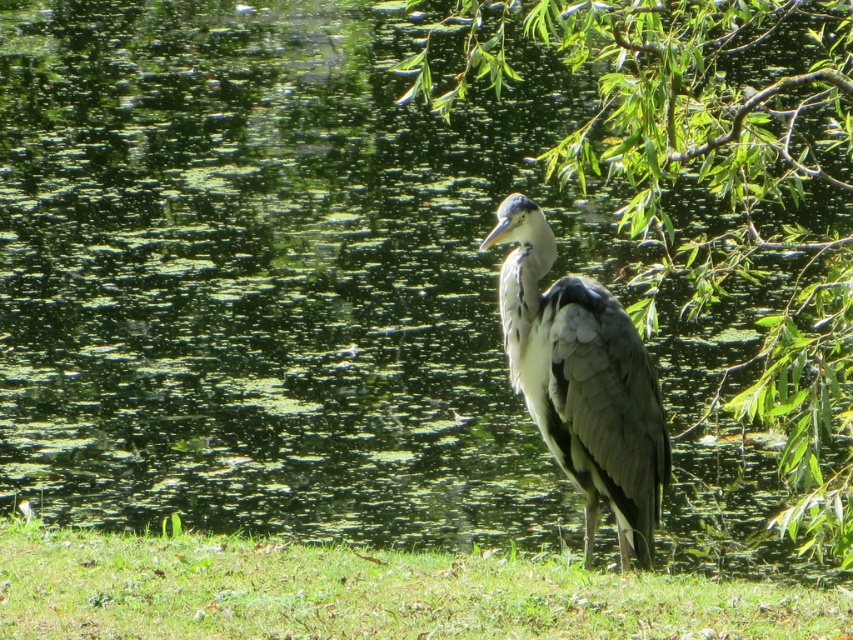
Question: Is green leafy tree at center positioned at the back of green grass at lower center?

Choices:
 (A) yes
 (B) no

Answer: (B)

Question: Among these points, which one is farthest from the camera?

Choices:
 (A) (247, 634)
 (B) (648, 476)
 (C) (647, 131)

Answer: (B)

Question: Is green leafy tree at center above gray feathered heron at center?

Choices:
 (A) no
 (B) yes

Answer: (B)

Question: From the image, what is the correct spatial relationship of green leafy tree at center in relation to gray feathered heron at center?

Choices:
 (A) above
 (B) below

Answer: (A)

Question: Which of the following is the closest to the observer?

Choices:
 (A) green leafy tree at center
 (B) green grass at lower center
 (C) gray feathered heron at center

Answer: (A)

Question: Among these objects, which one is nearest to the camera?

Choices:
 (A) green leafy tree at center
 (B) green grass at lower center

Answer: (A)